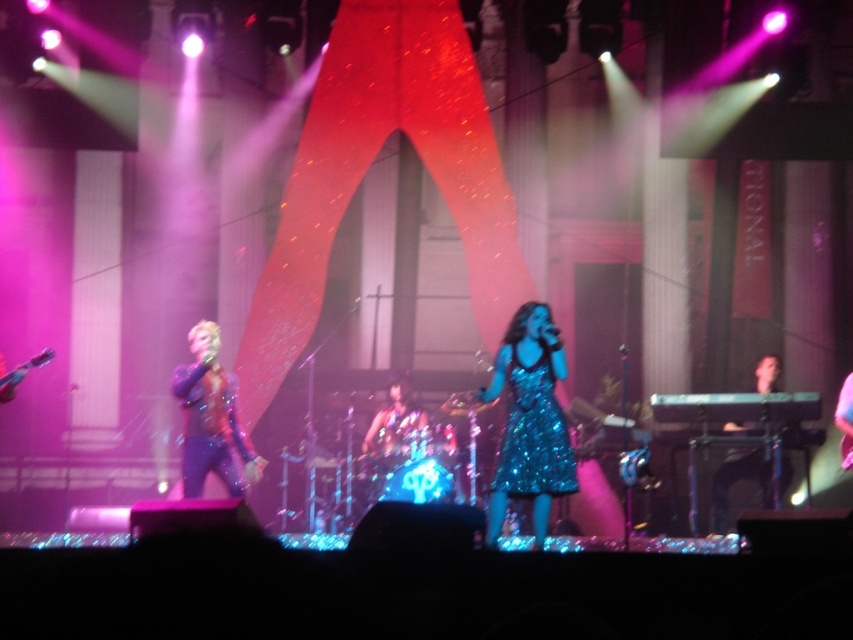
Question: Which of the following is the closest to the observer?

Choices:
 (A) shiny blue dress at center
 (B) black glossy keyboard at right
 (C) sparkly blue dress at center

Answer: (C)

Question: Estimate the real-world distances between objects in this image. Which object is closer to the sparkly purple dress at left?

Choices:
 (A) sparkly blue dress at center
 (B) shiny blue dress at center

Answer: (B)

Question: Does sparkly blue dress at center appear on the left side of shiny blue dress at center?

Choices:
 (A) yes
 (B) no

Answer: (B)

Question: Which point is closer to the camera taking this photo?

Choices:
 (A) (531, 403)
 (B) (227, 396)
 (C) (753, 474)
 (D) (378, 442)

Answer: (A)

Question: Does black glossy keyboard at right have a smaller size compared to shiny blue dress at center?

Choices:
 (A) no
 (B) yes

Answer: (B)

Question: Is sparkly purple dress at left smaller than shiny blue dress at center?

Choices:
 (A) no
 (B) yes

Answer: (B)